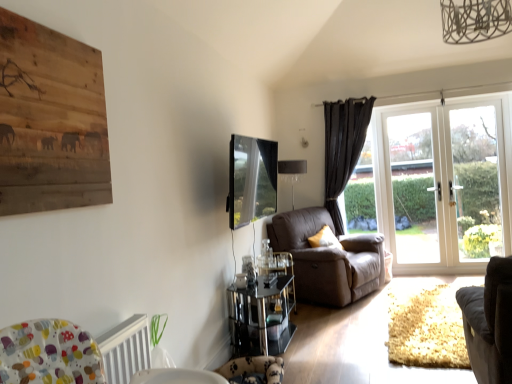
This screenshot has height=384, width=512. I want to click on free space above wooden painting at upper left (from a real-world perspective), so click(46, 30).